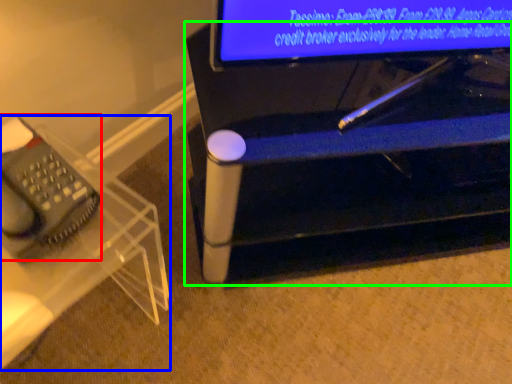
Question: Which is nearer to the equipment (highlighted by a red box)? furniture (highlighted by a blue box) or furniture (highlighted by a green box).

Choices:
 (A) furniture
 (B) furniture

Answer: (A)